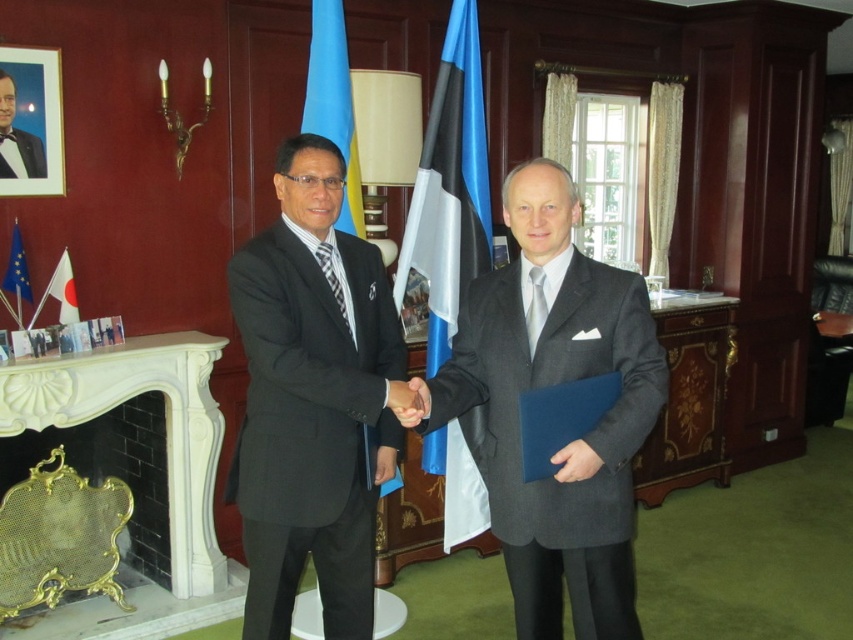
Who is taller, blue fabric flag at center or white fabric flag at left?

blue fabric flag at center

Is blue fabric flag at center shorter than white fabric flag at left?

No, blue fabric flag at center is not shorter than white fabric flag at left.

Who is more forward, (320, 44) or (62, 323)?

Positioned in front is point (320, 44).

Image resolution: width=853 pixels, height=640 pixels. In order to click on blue fabric flag at center in this screenshot , I will do `click(334, 104)`.

Who is more forward, (x=482, y=296) or (x=76, y=305)?

Point (x=482, y=296)

Which is behind, point (560, 573) or point (68, 323)?

The point (68, 323) is more distant.

Find the location of a particular element. Image resolution: width=853 pixels, height=640 pixels. gray wool suit at center is located at coordinates (550, 385).

Is black satin suit at upper left above blue fabric flag at left?

Yes.

Can you confirm if black satin suit at upper left is taller than blue fabric flag at left?

No, black satin suit at upper left is not taller than blue fabric flag at left.

Locate an element on the screen. black satin suit at upper left is located at coordinates (20, 154).